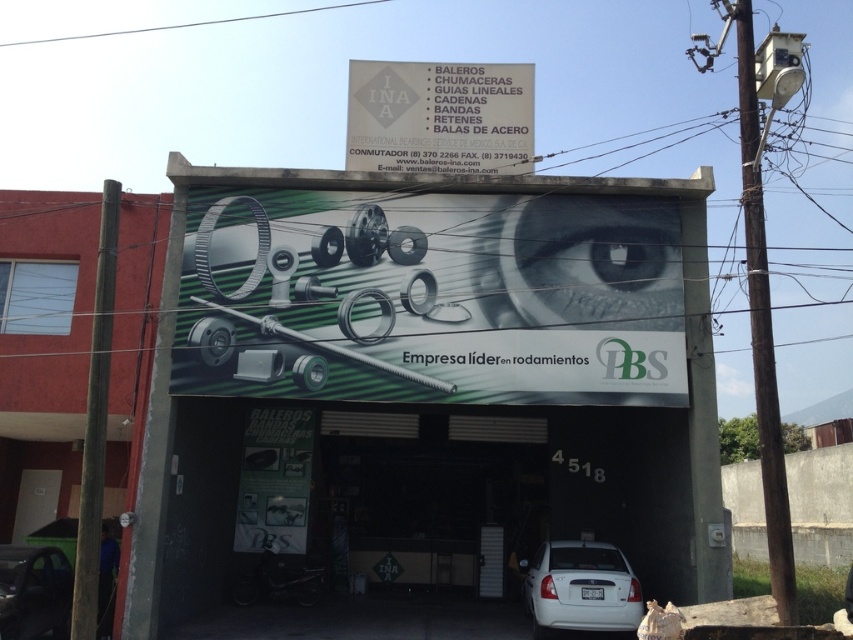
You are a customer looking to purchase bearings for your car. You see the white matte car at lower right and the gray matte eye at upper center. Which object is thinner?

The white matte car at lower right is thinner than the gray matte eye at upper center.

You are standing in front of the shop and want to read the information on the white paper at lower center. Can you read the details clearly from your current position?

The white paper at lower center is 16.47 meters away from the viewer, which is too far to read the details clearly. Move closer to the white paper at lower center for better visibility.

You are standing in front of the shop and want to take a photo of the white matte car at lower right and the gray matte eye at upper center. Which object will appear larger in your photo?

The white matte car at lower right will appear larger in the photo because it is closer to the viewer than the gray matte eye at upper center.